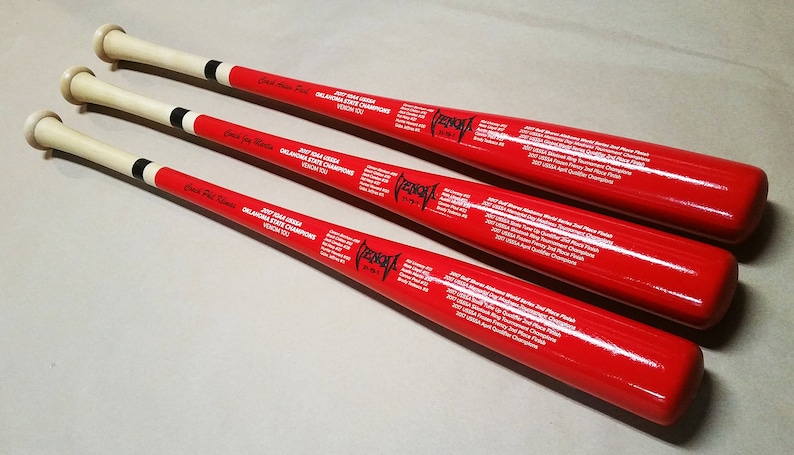
The height and width of the screenshot is (455, 794). What are the coordinates of `counter/table upper` in the screenshot? It's located at (484, 15).